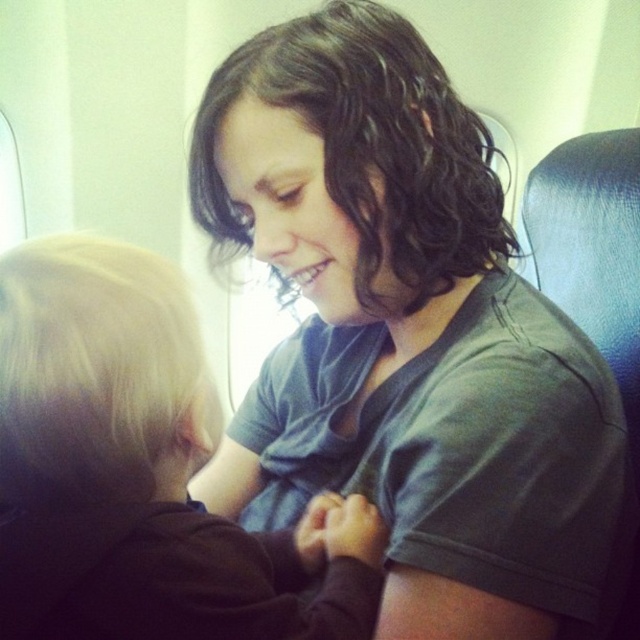
Question: Does dark green fabric shirt at center have a greater width compared to dark brown hair at upper center?

Choices:
 (A) yes
 (B) no

Answer: (A)

Question: Can you confirm if dark green fabric shirt at center is wider than dark brown hair at upper center?

Choices:
 (A) no
 (B) yes

Answer: (B)

Question: Can you confirm if dark green fabric shirt at center is positioned to the left of dark brown hair at upper center?

Choices:
 (A) no
 (B) yes

Answer: (A)